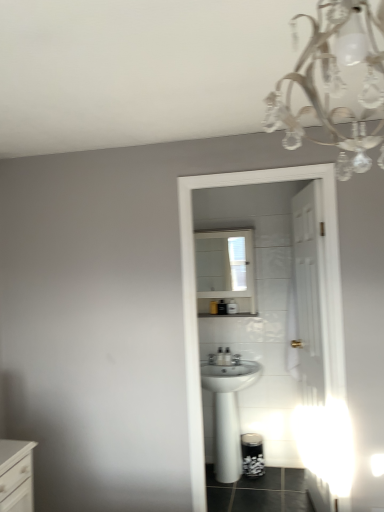
Question: Is white glossy medicine cabinet at center at the left side of white glossy sink at center?

Choices:
 (A) no
 (B) yes

Answer: (B)

Question: From a real-world perspective, is white glossy medicine cabinet at center physically above white glossy sink at center?

Choices:
 (A) yes
 (B) no

Answer: (A)

Question: Are white glossy medicine cabinet at center and white glossy sink at center making contact?

Choices:
 (A) no
 (B) yes

Answer: (A)

Question: From a real-world perspective, is white glossy medicine cabinet at center positioned under white glossy sink at center based on gravity?

Choices:
 (A) yes
 (B) no

Answer: (B)

Question: Can you confirm if white glossy medicine cabinet at center is bigger than white glossy sink at center?

Choices:
 (A) no
 (B) yes

Answer: (A)

Question: Is point (29, 507) closer or farther from the camera than point (211, 237)?

Choices:
 (A) closer
 (B) farther

Answer: (A)

Question: Choose the correct answer: Is white glossy chest of drawers at lower left inside white glossy medicine cabinet at center or outside it?

Choices:
 (A) outside
 (B) inside

Answer: (A)

Question: Considering the positions of white glossy chest of drawers at lower left and white glossy medicine cabinet at center in the image, is white glossy chest of drawers at lower left taller or shorter than white glossy medicine cabinet at center?

Choices:
 (A) tall
 (B) short

Answer: (B)

Question: From the image's perspective, is white glossy chest of drawers at lower left above or below white glossy medicine cabinet at center?

Choices:
 (A) above
 (B) below

Answer: (B)

Question: Is white glossy sink at center wider or thinner than white glossy medicine cabinet at center?

Choices:
 (A) wide
 (B) thin

Answer: (A)

Question: From the image's perspective, relative to white glossy medicine cabinet at center, is white glossy sink at center above or below?

Choices:
 (A) below
 (B) above

Answer: (A)

Question: From a real-world perspective, is white glossy sink at center above or below white glossy medicine cabinet at center?

Choices:
 (A) below
 (B) above

Answer: (A)

Question: Looking at the image, does white glossy sink at center seem bigger or smaller compared to white glossy medicine cabinet at center?

Choices:
 (A) big
 (B) small

Answer: (A)

Question: In terms of size, does white glossy medicine cabinet at center appear bigger or smaller than white glossy chest of drawers at lower left?

Choices:
 (A) small
 (B) big

Answer: (B)

Question: Looking at their shapes, would you say white glossy medicine cabinet at center is wider or thinner than white glossy chest of drawers at lower left?

Choices:
 (A) thin
 (B) wide

Answer: (A)